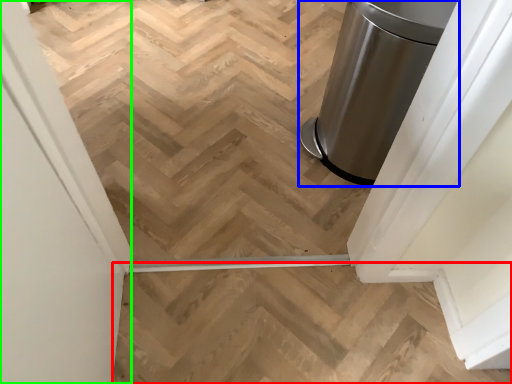
Question: Which is farther away from stairs (highlighted by a red box)? waste container (highlighted by a blue box) or screen door (highlighted by a green box)?

Choices:
 (A) waste container
 (B) screen door

Answer: (A)